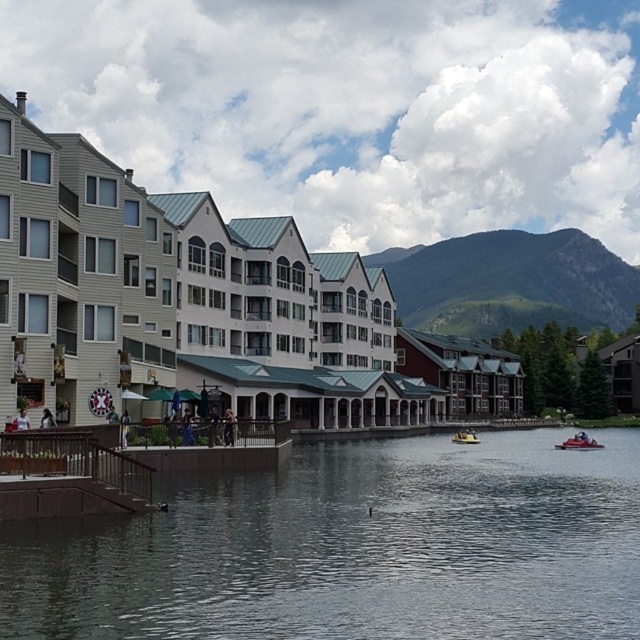
What is the significance of the point marked at coordinates (208,307) in the waterfront scene?

The point marked at coordinates (208,307) indicates the location of the beige siding building at center in the waterfront scene.

You are standing on the waterfront walkway and want to take a photo of the green grassy mountain at upper right. If your camera can focus on objects up to 300 meters away, will it be able to capture the mountain clearly?

The green grassy mountain at upper right is 308.72 meters away from the viewer. Since the camera can focus up to 300 meters, it cannot capture the mountain clearly as it is beyond the maximum focusing distance.

You are standing on the paved walkway and want to move towards the water. Which object, the brown wooden dock at lower left or the metallic red speedboat at lower right, will you encounter first based on their size?

The brown wooden dock at lower left occupies less space than the metallic red speedboat at lower right, so you will encounter the metallic red speedboat at lower right first as it is larger and closer to your path.